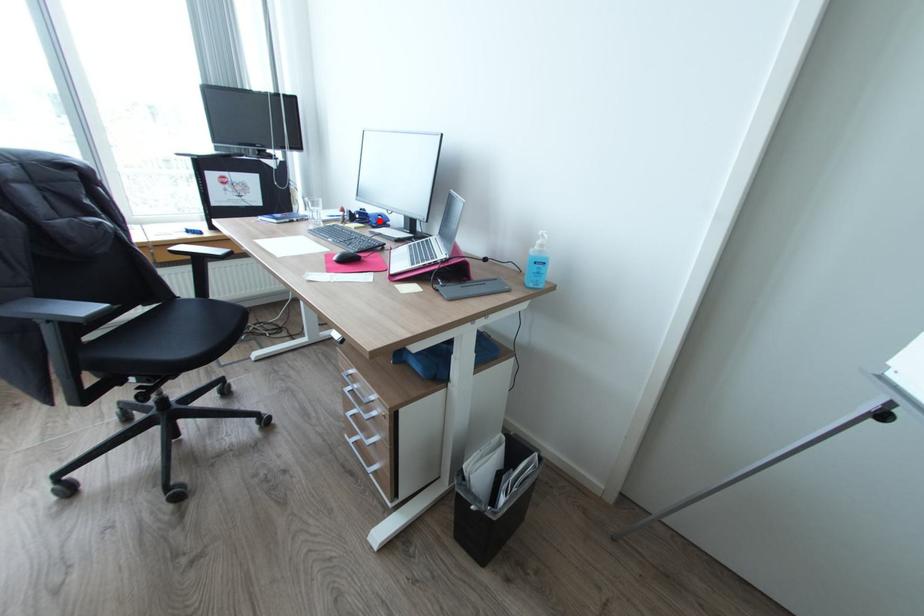
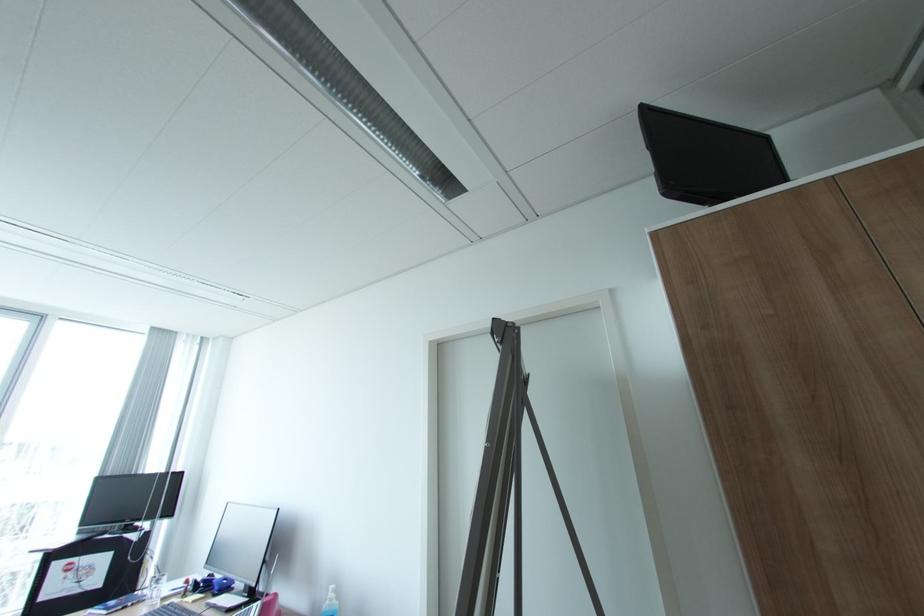
The point at the highlighted location is marked in the first image. Where is the corresponding point in the second image?

(222, 588)